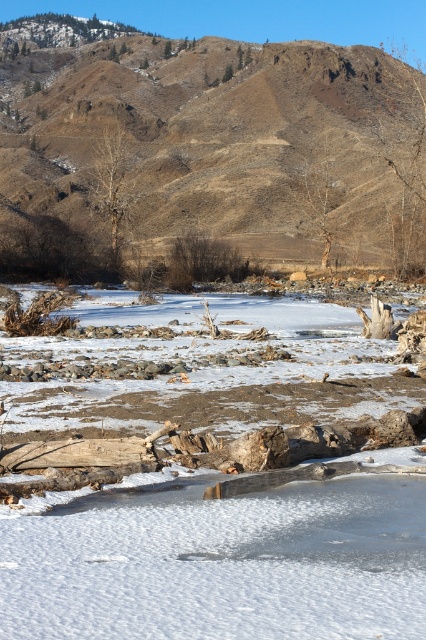
You are standing at the edge of the frozen body of water in the winter landscape. You see a point marked at coordinates (x=216, y=561). What is located at that point?

The white matte snow at center is located at point (x=216, y=561).